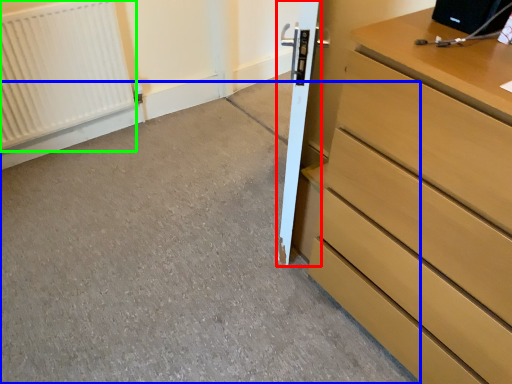
Question: Based on their relative distances, which object is farther from door (highlighted by a red box)? Choose from concrete (highlighted by a blue box) and radiator (highlighted by a green box).

Choices:
 (A) concrete
 (B) radiator

Answer: (B)